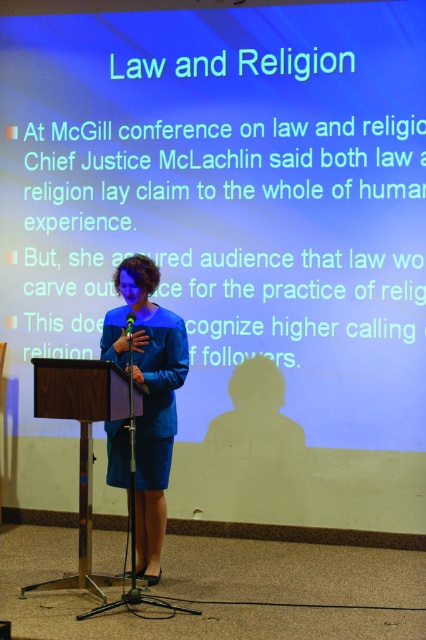
Is matte blue dress at center smaller than green plastic microphone at center?

No, matte blue dress at center is not smaller than green plastic microphone at center.

Which is in front, point (115, 440) or point (129, 333)?

Point (129, 333) is in front.

Does point (106, 340) come closer to viewer compared to point (129, 321)?

No, (106, 340) is further to viewer.

You are a GUI agent. You are given a task and a screenshot of the screen. Output one action in this format:
    pyautogui.click(x=<x>, y=<y>)
    Task: Click on the matte blue dress at center
    The height and width of the screenshot is (640, 426).
    Given the screenshot: What is the action you would take?
    pyautogui.click(x=149, y=396)

Can you confirm if matte blue dress at center is shorter than wooden podium at center?

No, matte blue dress at center is not shorter than wooden podium at center.

Does matte blue dress at center come behind wooden podium at center?

Yes, it is.

Identify the location of matte blue dress at center. The width and height of the screenshot is (426, 640). (149, 396).

I want to click on matte blue dress at center, so click(149, 396).

Between wooden podium at center and green plastic microphone at center, which one has more height?

wooden podium at center

Which is in front, point (74, 387) or point (129, 337)?

Point (74, 387)

I want to click on wooden podium at center, so click(80, 442).

Image resolution: width=426 pixels, height=640 pixels. Find the location of `wooden podium at center`. wooden podium at center is located at coordinates (80, 442).